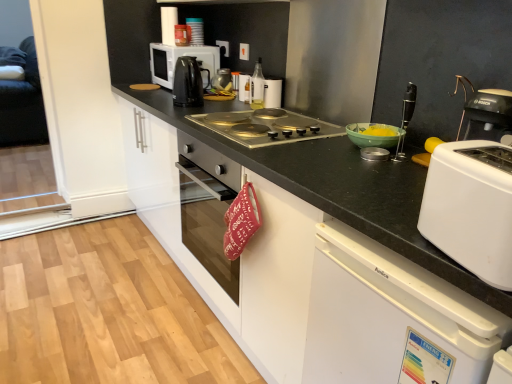
How much space does clear glass bottle at center, the second kitchen appliance in the right-to-left sequence, occupy horizontally?

clear glass bottle at center, the second kitchen appliance in the right-to-left sequence, is 3.09 inches wide.

What do you see at coordinates (257, 87) in the screenshot? This screenshot has height=384, width=512. I see `clear glass bottle at center, the second kitchen appliance in the right-to-left sequence` at bounding box center [257, 87].

The height and width of the screenshot is (384, 512). Describe the element at coordinates (311, 227) in the screenshot. I see `white matte cabinet at center, marked as the first cabinetry in a back-to-front arrangement` at that location.

Where is `metallic silver canister at upper center, which is counted as the 3th kitchen appliance, starting from the left`? metallic silver canister at upper center, which is counted as the 3th kitchen appliance, starting from the left is located at coordinates (196, 30).

This screenshot has width=512, height=384. What do you see at coordinates (196, 30) in the screenshot?
I see `metallic silver canister at upper center, which is counted as the 3th kitchen appliance, starting from the left` at bounding box center [196, 30].

Measure the distance between metallic silver gas stove at center and camera.

metallic silver gas stove at center is 4.65 feet from camera.

Describe the element at coordinates (266, 127) in the screenshot. I see `metallic silver gas stove at center` at that location.

This screenshot has width=512, height=384. What do you see at coordinates (222, 82) in the screenshot? I see `metallic silver kettle at center, the 4th kitchen appliance when ordered from right to left` at bounding box center [222, 82].

Identify the location of clear glass bottle at center, the second kitchen appliance in the right-to-left sequence. This screenshot has height=384, width=512. (257, 87).

Is matte plastic jar at upper center, arranged as the seventh kitchen appliance when viewed from the right, far from translucent glass bottle at center, the sixth kitchen appliance viewed from the left?

matte plastic jar at upper center, arranged as the seventh kitchen appliance when viewed from the right, is near translucent glass bottle at center, the sixth kitchen appliance viewed from the left, not far away.

From a real-world perspective, starting from the matte plastic jar at upper center, which ranks as the second kitchen appliance in left-to-right order, which kitchen appliance is the 6th one below it? Please provide its 2D coordinates.

[(245, 88)]

Consider the image. From a real-world perspective, between matte plastic jar at upper center, which ranks as the second kitchen appliance in left-to-right order, and translucent glass bottle at center, the sixth kitchen appliance viewed from the left, who is vertically lower?

In real-world perspective, translucent glass bottle at center, the sixth kitchen appliance viewed from the left, is lower.

Is matte plastic jar at upper center, which ranks as the second kitchen appliance in left-to-right order, positioned with its back to translucent glass bottle at center, the sixth kitchen appliance viewed from the left?

No, matte plastic jar at upper center, which ranks as the second kitchen appliance in left-to-right order, is not facing away from translucent glass bottle at center, the sixth kitchen appliance viewed from the left.

Is the depth of metallic silver canister at upper center, arranged as the 6th kitchen appliance when viewed from the right, less than that of matte plastic jar at upper center, which ranks as the second kitchen appliance in left-to-right order?

No, it is not.

Between point (199, 43) and point (186, 36), which one is positioned behind?

The point (199, 43) is farther from the camera.

Is metallic silver canister at upper center, arranged as the 6th kitchen appliance when viewed from the right, not within matte plastic jar at upper center, which ranks as the second kitchen appliance in left-to-right order?

Yes, metallic silver canister at upper center, arranged as the 6th kitchen appliance when viewed from the right, is located beyond the bounds of matte plastic jar at upper center, which ranks as the second kitchen appliance in left-to-right order.

In order to click on gas stove that is above the white plastic toaster at right (from the image's perspective) in this screenshot , I will do `click(266, 127)`.

How different are the orientations of metallic silver gas stove at center and white plastic toaster at right in degrees?

They differ by 16.5 degrees in their facing directions.

Is metallic silver gas stove at center closer to the viewer compared to white plastic toaster at right?

No, metallic silver gas stove at center is behind white plastic toaster at right.

Considering the relative sizes of metallic silver gas stove at center and white plastic toaster at right in the image provided, is metallic silver gas stove at center smaller than white plastic toaster at right?

Actually, metallic silver gas stove at center might be larger than white plastic toaster at right.

Considering the positions of points (405, 250) and (426, 182), is point (405, 250) closer to camera compared to point (426, 182)?

Yes, it is in front of point (426, 182).

Which of these two, white matte cabinet at center, which ranks as the 2th cabinetry in front-to-back order, or white plastic toaster at right, is wider?

With larger width is white matte cabinet at center, which ranks as the 2th cabinetry in front-to-back order.

From a real-world perspective, is white matte cabinet at center, marked as the first cabinetry in a back-to-front arrangement, over white plastic toaster at right?

Actually, white matte cabinet at center, marked as the first cabinetry in a back-to-front arrangement, is physically below white plastic toaster at right in the real world.

Which object is thinner, white matte cabinet at center, which ranks as the 2th cabinetry in front-to-back order, or white plastic dishwasher at lower right, the first cabinetry positioned from the front?

With smaller width is white plastic dishwasher at lower right, the first cabinetry positioned from the front.

Between white matte cabinet at center, which ranks as the 2th cabinetry in front-to-back order, and white plastic dishwasher at lower right, the first cabinetry positioned from the front, which one appears on the right side from the viewer's perspective?

white plastic dishwasher at lower right, the first cabinetry positioned from the front, is more to the right.

Is white matte cabinet at center, which ranks as the 2th cabinetry in front-to-back order, directly adjacent to white plastic dishwasher at lower right, the first cabinetry positioned from the front?

No, white matte cabinet at center, which ranks as the 2th cabinetry in front-to-back order, is not touching white plastic dishwasher at lower right, the first cabinetry positioned from the front.

Based on the photo, which point is more distant from viewer, (264, 307) or (407, 374)?

The point (264, 307) is more distant.

From a real-world perspective, is translucent glass bottle at center, the sixth kitchen appliance viewed from the left, beneath white glossy microwave at upper left, which appears as the 1th kitchen appliance when viewed from the left?

Yes, from a real-world perspective, translucent glass bottle at center, the sixth kitchen appliance viewed from the left, is beneath white glossy microwave at upper left, which appears as the 1th kitchen appliance when viewed from the left.

Identify the location of the 3rd kitchen appliance below when counting from the white glossy microwave at upper left, which appears as the 1th kitchen appliance when viewed from the left (from the image's perspective). This screenshot has width=512, height=384. (245, 88).

Looking at this image, who is more distant, translucent glass bottle at center, positioned as the 3th kitchen appliance in right-to-left order, or white glossy microwave at upper left, which appears as the 1th kitchen appliance when viewed from the left?

white glossy microwave at upper left, which appears as the 1th kitchen appliance when viewed from the left, is behind.

Is point (239, 90) positioned before point (206, 78)?

Yes, point (239, 90) is closer to viewer.

From a real-world perspective, is translucent glass bottle at center, positioned as the 3th kitchen appliance in right-to-left order, beneath metallic silver canister at upper center, which is counted as the 3th kitchen appliance, starting from the left?

Yes, from a real-world perspective, translucent glass bottle at center, positioned as the 3th kitchen appliance in right-to-left order, is below metallic silver canister at upper center, which is counted as the 3th kitchen appliance, starting from the left.

From the image's perspective, which object appears higher, translucent glass bottle at center, positioned as the 3th kitchen appliance in right-to-left order, or metallic silver canister at upper center, arranged as the 6th kitchen appliance when viewed from the right?

From the image's view, metallic silver canister at upper center, arranged as the 6th kitchen appliance when viewed from the right, is above.

Is translucent glass bottle at center, positioned as the 3th kitchen appliance in right-to-left order, not close to metallic silver canister at upper center, arranged as the 6th kitchen appliance when viewed from the right?

translucent glass bottle at center, positioned as the 3th kitchen appliance in right-to-left order, is near metallic silver canister at upper center, arranged as the 6th kitchen appliance when viewed from the right, not far away.

You are a GUI agent. You are given a task and a screenshot of the screen. Output one action in this format:
    pyautogui.click(x=<x>, y=<y>)
    Task: Click on the 4th kitchen appliance above the translucent glass bottle at center, positioned as the 3th kitchen appliance in right-to-left order (from the image's perspective)
    
    Given the screenshot: What is the action you would take?
    pyautogui.click(x=182, y=35)

Locate an element on the screen. Image resolution: width=512 pixels, height=384 pixels. the 2nd kitchen appliance behind the matte plastic jar at upper center, which ranks as the second kitchen appliance in left-to-right order, counting from the anchor's position is located at coordinates (196, 30).

Estimate the real-world distances between objects in this image. Which object is further from translucent glass bottle at center, positioned as the 3th kitchen appliance in right-to-left order, white plastic dishwasher at lower right, the first cabinetry positioned from the front, or white glossy canister at upper center, which is the first kitchen appliance in right-to-left order?

white plastic dishwasher at lower right, the first cabinetry positioned from the front, lies further to translucent glass bottle at center, positioned as the 3th kitchen appliance in right-to-left order, than the other object.

Considering their positions, is white plastic dishwasher at lower right, the first cabinetry positioned from the front, positioned closer to white glossy microwave at upper left, which appears as the 1th kitchen appliance when viewed from the left, than translucent glass bottle at center, the sixth kitchen appliance viewed from the left?

Based on the image, translucent glass bottle at center, the sixth kitchen appliance viewed from the left, appears to be nearer to white glossy microwave at upper left, which appears as the 1th kitchen appliance when viewed from the left.

Which object lies further to the anchor point black glossy electric kettle at upper center, the fifth kitchen appliance viewed from the right, white plastic dishwasher at lower right, the first cabinetry positioned from the front, or green matte bowl at right?

white plastic dishwasher at lower right, the first cabinetry positioned from the front, lies further to black glossy electric kettle at upper center, the fifth kitchen appliance viewed from the right, than the other object.

Based on their spatial positions, is clear glass bottle at center, the seventh kitchen appliance from the left, or white glossy canister at upper center, which is the first kitchen appliance in right-to-left order, closer to green matte bowl at right?

white glossy canister at upper center, which is the first kitchen appliance in right-to-left order, is positioned closer to the anchor green matte bowl at right.

Looking at the image, which one is located closer to white plastic dishwasher at lower right, the first cabinetry positioned from the front, black glossy electric kettle at upper center, the fifth kitchen appliance viewed from the right, or white glossy microwave at upper left, which appears as the 1th kitchen appliance when viewed from the left?

Among the two, black glossy electric kettle at upper center, the fifth kitchen appliance viewed from the right, is located nearer to white plastic dishwasher at lower right, the first cabinetry positioned from the front.

Considering their positions, is metallic silver canister at upper center, which is counted as the 3th kitchen appliance, starting from the left, positioned further to black glossy electric kettle at upper center, the fifth kitchen appliance viewed from the right, than metallic silver kettle at center, which is counted as the 5th kitchen appliance, starting from the left?

metallic silver canister at upper center, which is counted as the 3th kitchen appliance, starting from the left, is further to black glossy electric kettle at upper center, the fifth kitchen appliance viewed from the right.

Consider the image. When comparing their distances from clear glass bottle at center, the seventh kitchen appliance from the left, does matte plastic jar at upper center, which ranks as the second kitchen appliance in left-to-right order, or black glossy electric kettle at upper center, the fifth kitchen appliance viewed from the right, seem closer?

black glossy electric kettle at upper center, the fifth kitchen appliance viewed from the right, is positioned closer to the anchor clear glass bottle at center, the seventh kitchen appliance from the left.

Looking at the image, which one is located further to metallic silver gas stove at center, white glossy canister at upper center, which is the first kitchen appliance in right-to-left order, or white plastic toaster at right?

Based on the image, white plastic toaster at right appears to be further to metallic silver gas stove at center.

Image resolution: width=512 pixels, height=384 pixels. I want to click on gas stove located between white plastic toaster at right and white glossy microwave at upper left, the 8th kitchen appliance from the right, in the depth direction, so click(266, 127).

I want to click on bowl positioned between white plastic dishwasher at lower right, the first cabinetry positioned from the front, and metallic silver kettle at center, the 4th kitchen appliance when ordered from right to left, from near to far, so click(374, 135).

Find the location of a particular element. This screenshot has height=384, width=512. kitchen appliance between metallic silver canister at upper center, arranged as the 6th kitchen appliance when viewed from the right, and white glossy microwave at upper left, which appears as the 1th kitchen appliance when viewed from the left, vertically is located at coordinates (182, 35).

You are a GUI agent. You are given a task and a screenshot of the screen. Output one action in this format:
    pyautogui.click(x=<x>, y=<y>)
    Task: Click on the gas stove located between white plastic dishwasher at lower right, the second cabinetry positioned from the back, and metallic silver canister at upper center, which is counted as the 3th kitchen appliance, starting from the left, in the depth direction
    The image size is (512, 384).
    Given the screenshot: What is the action you would take?
    pyautogui.click(x=266, y=127)